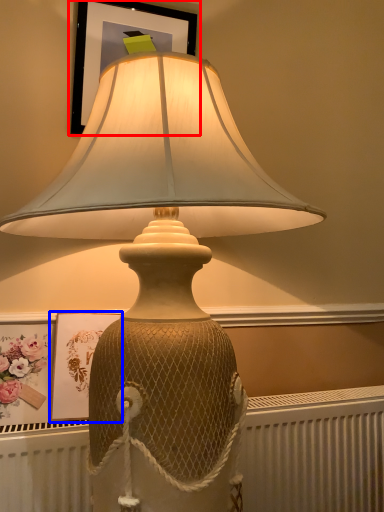
Question: Which object is closer to the camera taking this photo, picture frame (highlighted by a red box) or picture frame (highlighted by a blue box)?

Choices:
 (A) picture frame
 (B) picture frame

Answer: (B)